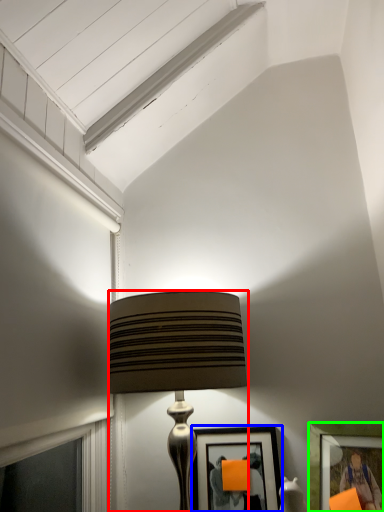
Question: Considering the real-world distances, which object is closest to lamp (highlighted by a red box)? picture frame (highlighted by a blue box) or picture frame (highlighted by a green box).

Choices:
 (A) picture frame
 (B) picture frame

Answer: (A)